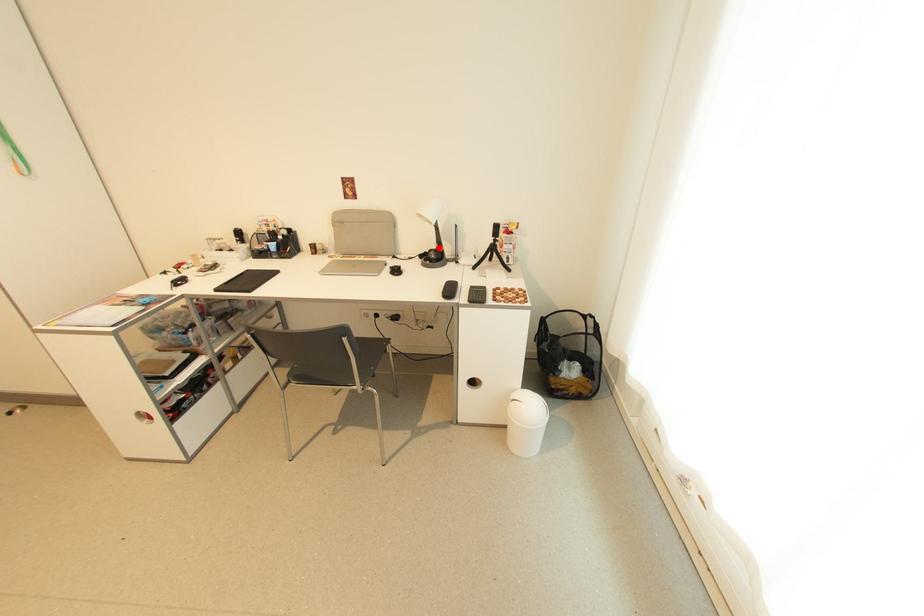
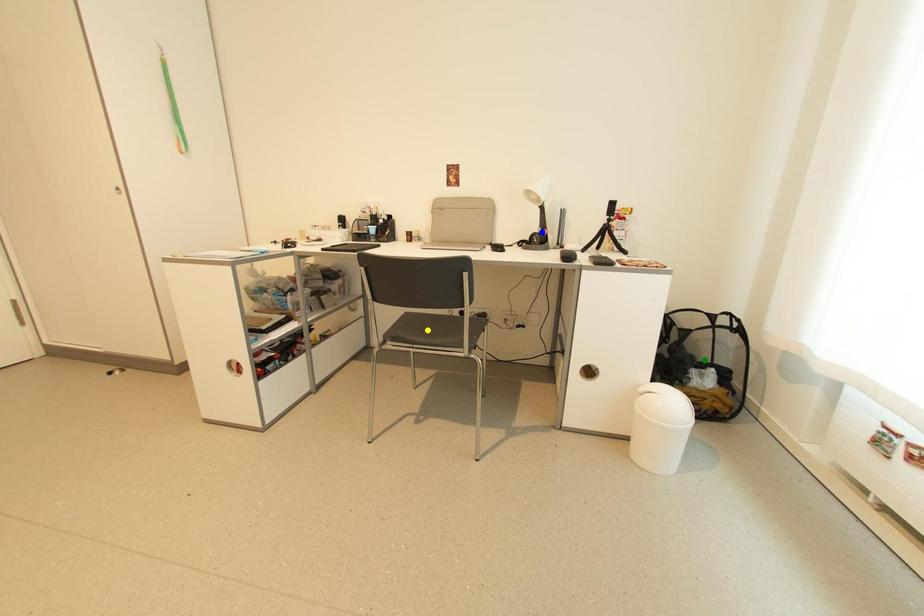
Question: I am providing you with two images of the same scene from different viewpoints. A red point is marked on the first image. You are given multiple points on the second image. Can you choose the point in image 2 that corresponds to the point in image 1?

Choices:
 (A) green point
 (B) blue point
 (C) yellow point

Answer: (B)